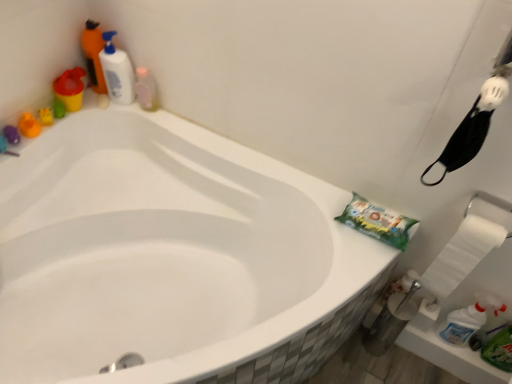
Question: From a real-world perspective, is white glossy bottle at upper left, acting as the second cleaning product starting from the left, on translucent plastic bottle at upper left, positioned as the 1th cleaning product in right-to-left order?

Choices:
 (A) no
 (B) yes

Answer: (B)

Question: Does white glossy bottle at upper left, the second cleaning product positioned from the right, have a larger size compared to translucent plastic bottle at upper left, acting as the third cleaning product starting from the left?

Choices:
 (A) yes
 (B) no

Answer: (A)

Question: Would you say white glossy bottle at upper left, acting as the second cleaning product starting from the left, contains translucent plastic bottle at upper left, positioned as the 1th cleaning product in right-to-left order?

Choices:
 (A) yes
 (B) no

Answer: (B)

Question: Does white glossy bottle at upper left, the second cleaning product positioned from the right, have a lesser width compared to translucent plastic bottle at upper left, acting as the third cleaning product starting from the left?

Choices:
 (A) no
 (B) yes

Answer: (A)

Question: From a real-world perspective, is white glossy bottle at upper left, acting as the second cleaning product starting from the left, located beneath translucent plastic bottle at upper left, positioned as the 1th cleaning product in right-to-left order?

Choices:
 (A) yes
 (B) no

Answer: (B)

Question: Looking at their shapes, would you say translucent plastic bottle at upper left, acting as the third cleaning product starting from the left, is wider or thinner than white glossy bottle at upper left, acting as the second cleaning product starting from the left?

Choices:
 (A) wide
 (B) thin

Answer: (B)

Question: Is translucent plastic bottle at upper left, positioned as the 1th cleaning product in right-to-left order, in front of or behind white glossy bottle at upper left, the second cleaning product positioned from the right, in the image?

Choices:
 (A) behind
 (B) front

Answer: (A)

Question: Is translucent plastic bottle at upper left, acting as the third cleaning product starting from the left, spatially inside white glossy bottle at upper left, acting as the second cleaning product starting from the left, or outside of it?

Choices:
 (A) inside
 (B) outside

Answer: (B)

Question: In terms of height, does translucent plastic bottle at upper left, positioned as the 1th cleaning product in right-to-left order, look taller or shorter compared to white glossy bottle at upper left, acting as the second cleaning product starting from the left?

Choices:
 (A) short
 (B) tall

Answer: (A)

Question: Is white paper towel at right wider or thinner than green paper towel at upper right?

Choices:
 (A) wide
 (B) thin

Answer: (B)

Question: From the image's perspective, is white paper towel at right above or below green paper towel at upper right?

Choices:
 (A) below
 (B) above

Answer: (A)

Question: In terms of height, does white paper towel at right look taller or shorter compared to green paper towel at upper right?

Choices:
 (A) short
 (B) tall

Answer: (B)

Question: Is white paper towel at right inside the boundaries of green paper towel at upper right, or outside?

Choices:
 (A) outside
 (B) inside

Answer: (A)

Question: Relative to translucent plastic bottle at upper left, acting as the 3th cleaning product starting from the right, is green paper towel at upper right in front or behind?

Choices:
 (A) behind
 (B) front

Answer: (B)

Question: Is green paper towel at upper right taller or shorter than translucent plastic bottle at upper left, which is counted as the first cleaning product, starting from the left?

Choices:
 (A) short
 (B) tall

Answer: (A)